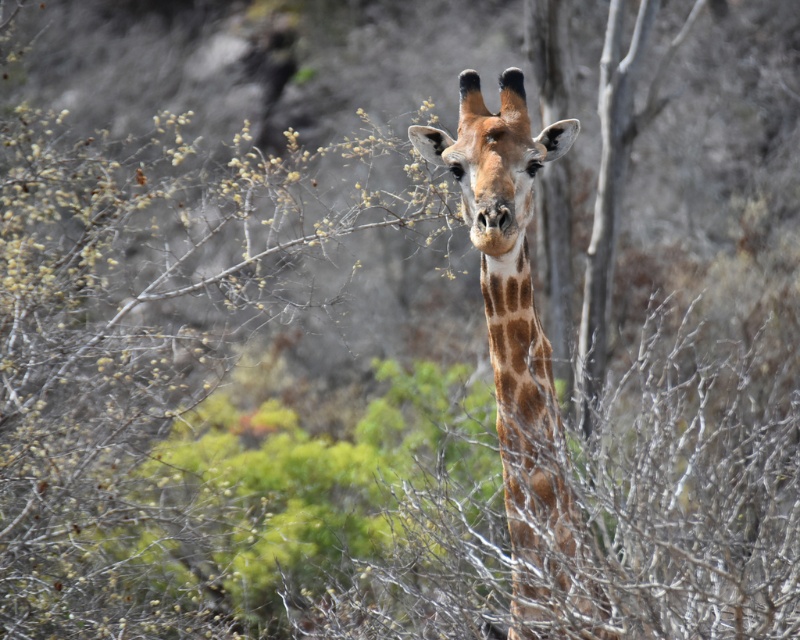
Between spotted fur giraffe head at center and brown spotted neck at center, which one has less height?

Standing shorter between the two is spotted fur giraffe head at center.

Is point (545, 134) positioned in front of point (514, 256)?

No, it is behind (514, 256).

Who is more distant from viewer, (542, 129) or (484, 292)?

Point (484, 292)

At what (x,y) coordinates should I click in order to perform the action: click on spotted fur giraffe head at center. Please return your answer as a coordinate pair (x, y). This screenshot has height=640, width=800. Looking at the image, I should click on (494, 157).

Can you confirm if brown spotted giraffe at center is smaller than brown spotted neck at center?

Actually, brown spotted giraffe at center might be larger than brown spotted neck at center.

Can you confirm if brown spotted giraffe at center is shorter than brown spotted neck at center?

No.

What do you see at coordinates (520, 355) in the screenshot? I see `brown spotted giraffe at center` at bounding box center [520, 355].

Locate an element on the screen. The image size is (800, 640). brown spotted giraffe at center is located at coordinates (520, 355).

Between brown spotted giraffe at center and spotted fur giraffe head at center, which one is positioned higher?

Positioned higher is spotted fur giraffe head at center.

Describe the element at coordinates (520, 355) in the screenshot. This screenshot has height=640, width=800. I see `brown spotted giraffe at center` at that location.

Who is more forward, [536,563] or [436,140]?

Point [536,563] is more forward.

The height and width of the screenshot is (640, 800). In order to click on brown spotted giraffe at center in this screenshot , I will do `click(520, 355)`.